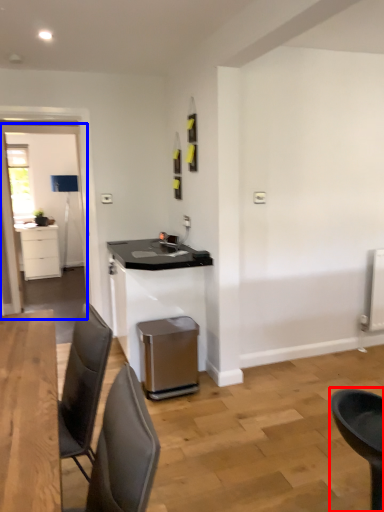
Question: Which point is further to the camera, chair (highlighted by a red box) or glass door (highlighted by a blue box)?

Choices:
 (A) chair
 (B) glass door

Answer: (B)